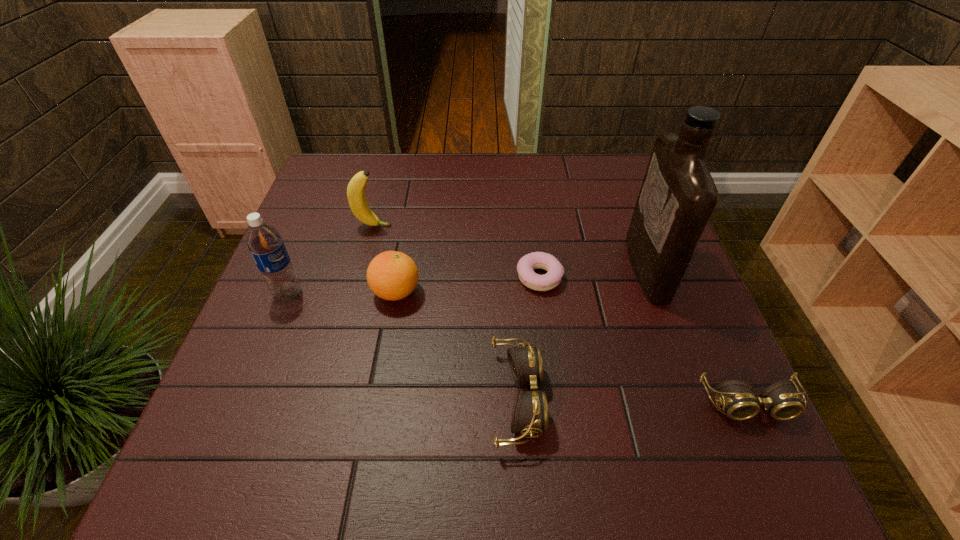
The height and width of the screenshot is (540, 960). What are the coordinates of `the second tallest object` in the screenshot? It's located at (264, 242).

The image size is (960, 540). I want to click on blank space located through the lenses of the left goggles, so click(x=635, y=399).

The width and height of the screenshot is (960, 540). Find the location of `vacant space positioned 0.260m from the stem of the banana`. vacant space positioned 0.260m from the stem of the banana is located at coordinates (490, 226).

What are the coordinates of `vacant space located on the left of the orange` in the screenshot? It's located at (284, 292).

The width and height of the screenshot is (960, 540). Identify the location of free location located 0.220m on the right of the shortest object. (657, 278).

Find the location of a particular element. This screenshot has width=960, height=540. free location located on the label side of the liquor is located at coordinates (498, 268).

Locate an element on the screen. This screenshot has width=960, height=540. vacant region located on the label side of the liquor is located at coordinates (544, 268).

The image size is (960, 540). What are the coordinates of `vacant area situated 0.240m on the label side of the liquor` in the screenshot? It's located at (532, 268).

Find the location of a particular element. This screenshot has height=540, width=960. free space located on the front of the second tallest object is located at coordinates (255, 376).

The width and height of the screenshot is (960, 540). I want to click on banana present at the left edge, so click(x=356, y=196).